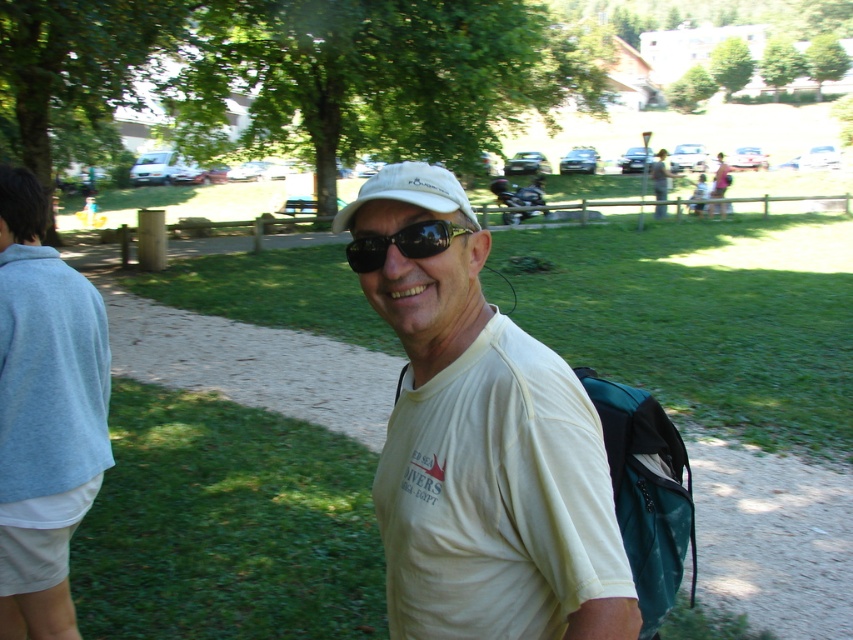
Looking at this image, you are a photographer trying to capture the man in the scene. The camera you are using has a focal point at point (479,440). Which object will be in focus?

The point at (479,440) corresponds to the white matte t shirt at center, so the white matte t shirt at center will be in focus.